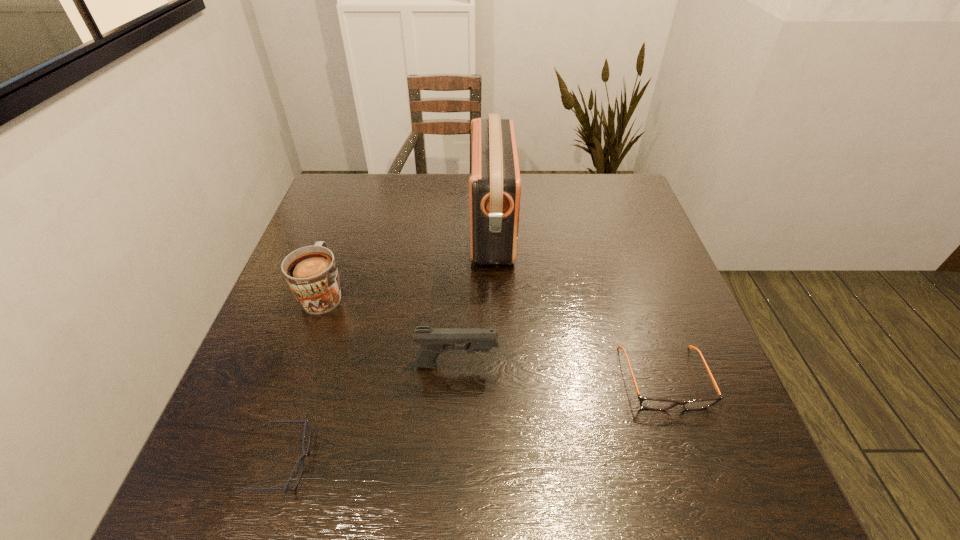
Where is `object that is positioned at the right edge`? Image resolution: width=960 pixels, height=540 pixels. object that is positioned at the right edge is located at coordinates (649, 403).

Where is `object at the near left corner`? object at the near left corner is located at coordinates (302, 457).

This screenshot has height=540, width=960. Identify the location of free space at the far edge. (559, 206).

The width and height of the screenshot is (960, 540). I want to click on free space at the left edge of the desktop, so click(x=348, y=272).

The image size is (960, 540). Identify the location of free space at the right edge of the desktop. pyautogui.click(x=621, y=287).

This screenshot has width=960, height=540. In the image, there is a desktop. In order to click on vacant space at the near left corner in this screenshot , I will do `click(271, 474)`.

Where is `vacant space at the far right corner of the desktop`? vacant space at the far right corner of the desktop is located at coordinates (622, 197).

At what (x,y) coordinates should I click in order to perform the action: click on vacant space at the near right corner. Please return your answer as a coordinate pair (x, y). The width and height of the screenshot is (960, 540). Looking at the image, I should click on 706,460.

Identify the location of vacant area that lies between the right spectacles and the nearer spectacles. (473, 420).

Image resolution: width=960 pixels, height=540 pixels. Identify the location of free space between the tallest object and the right spectacles. (578, 303).